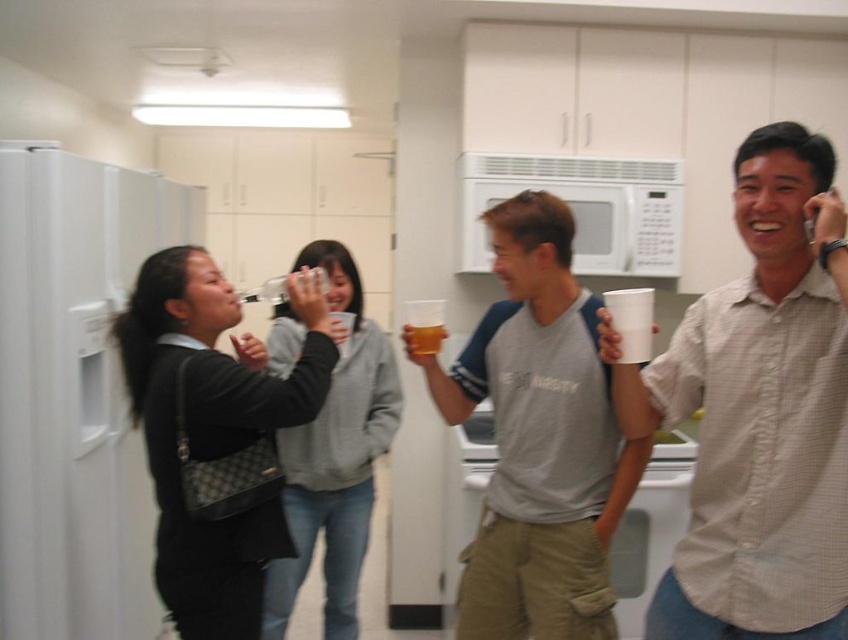
Question: Which point is farther from the camera taking this photo?

Choices:
 (A) (617, 161)
 (B) (438, 337)
 (C) (830, 541)

Answer: (A)

Question: Estimate the real-world distances between objects in this image. Which object is closer to the white matte microwave at upper center?

Choices:
 (A) white matte refrigerator at left
 (B) matte gray hoodie at center

Answer: (B)

Question: Which object is the farthest from the white shirt at right?

Choices:
 (A) white matte refrigerator at left
 (B) matte black purse at left
 (C) gray cotton t-shirt at center
 (D) matte gray hoodie at center

Answer: (A)

Question: Can you confirm if white shirt at right is smaller than translucent plastic cup at center?

Choices:
 (A) yes
 (B) no

Answer: (B)

Question: Considering the relative positions of white shirt at right and translucent plastic cup at center in the image provided, where is white shirt at right located with respect to translucent plastic cup at center?

Choices:
 (A) left
 (B) right

Answer: (B)

Question: Does matte black purse at left appear over matte gray hoodie at center?

Choices:
 (A) yes
 (B) no

Answer: (A)